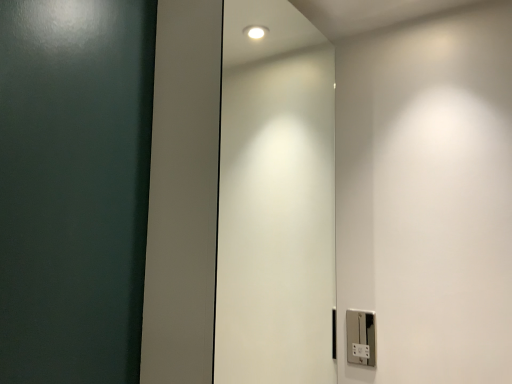
Question: From the image's perspective, is white glossy elevator door at center on top of silver metallic light switch at lower right?

Choices:
 (A) no
 (B) yes

Answer: (B)

Question: Can you confirm if white glossy elevator door at center is wider than silver metallic light switch at lower right?

Choices:
 (A) yes
 (B) no

Answer: (A)

Question: Would you say white glossy elevator door at center is a long distance from silver metallic light switch at lower right?

Choices:
 (A) no
 (B) yes

Answer: (A)

Question: Considering the relative sizes of white glossy elevator door at center and silver metallic light switch at lower right in the image provided, is white glossy elevator door at center smaller than silver metallic light switch at lower right?

Choices:
 (A) yes
 (B) no

Answer: (B)

Question: Considering the relative sizes of white glossy elevator door at center and silver metallic light switch at lower right in the image provided, is white glossy elevator door at center thinner than silver metallic light switch at lower right?

Choices:
 (A) yes
 (B) no

Answer: (B)

Question: Does white glossy elevator door at center have a greater height compared to silver metallic light switch at lower right?

Choices:
 (A) yes
 (B) no

Answer: (A)

Question: Is silver metallic light switch at lower right behind white glossy elevator door at center?

Choices:
 (A) yes
 (B) no

Answer: (A)

Question: From a real-world perspective, is silver metallic light switch at lower right on top of white glossy elevator door at center?

Choices:
 (A) no
 (B) yes

Answer: (A)

Question: From the image's perspective, is silver metallic light switch at lower right located above white glossy elevator door at center?

Choices:
 (A) yes
 (B) no

Answer: (B)

Question: Is silver metallic light switch at lower right wider than white glossy elevator door at center?

Choices:
 (A) yes
 (B) no

Answer: (B)

Question: Considering the relative sizes of silver metallic light switch at lower right and white glossy elevator door at center in the image provided, is silver metallic light switch at lower right taller than white glossy elevator door at center?

Choices:
 (A) yes
 (B) no

Answer: (B)

Question: Is silver metallic light switch at lower right closer to the viewer compared to white glossy elevator door at center?

Choices:
 (A) yes
 (B) no

Answer: (B)

Question: Is white glossy elevator door at center in front of or behind silver metallic light switch at lower right in the image?

Choices:
 (A) front
 (B) behind

Answer: (A)